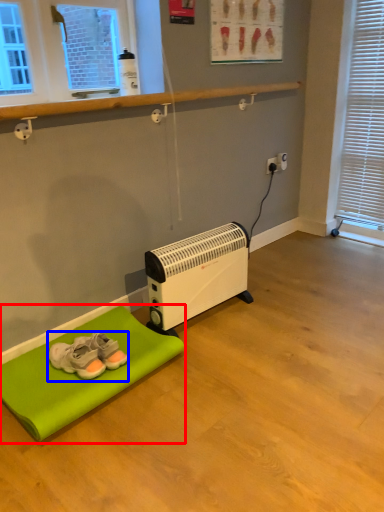
Question: Which point is closer to the camera, furniture (highlighted by a red box) or footwear (highlighted by a blue box)?

Choices:
 (A) furniture
 (B) footwear

Answer: (A)